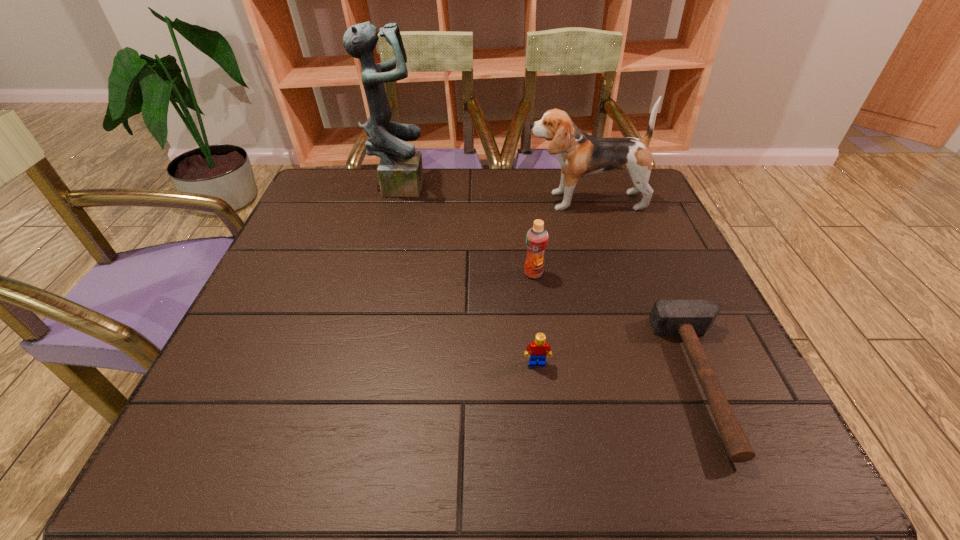
At what (x,y) coordinates should I click in order to perform the action: click on the tallest object. Please return your answer as a coordinate pair (x, y). Looking at the image, I should click on (400, 172).

The height and width of the screenshot is (540, 960). In order to click on the leftmost object in this screenshot , I will do `click(400, 172)`.

The height and width of the screenshot is (540, 960). What are the coordinates of `puppy` in the screenshot? It's located at (580, 155).

Identify the location of the third shortest object. (537, 237).

At what (x,y) coordinates should I click in order to perform the action: click on orange juice. Please return your answer as a coordinate pair (x, y). The height and width of the screenshot is (540, 960). Looking at the image, I should click on (537, 237).

This screenshot has width=960, height=540. Find the location of `Lego`. Lego is located at coordinates (538, 351).

Identify the location of hammer. The width and height of the screenshot is (960, 540). (687, 318).

The image size is (960, 540). In order to click on free region located on the face of the sculpture in this screenshot , I will do `click(542, 184)`.

Locate an element on the screen. This screenshot has height=540, width=960. free location located at the face of the puppy is located at coordinates (400, 201).

At what (x,y) coordinates should I click in order to perform the action: click on vacant space located at the face of the puppy. Please return your answer as a coordinate pair (x, y). Looking at the image, I should click on (429, 201).